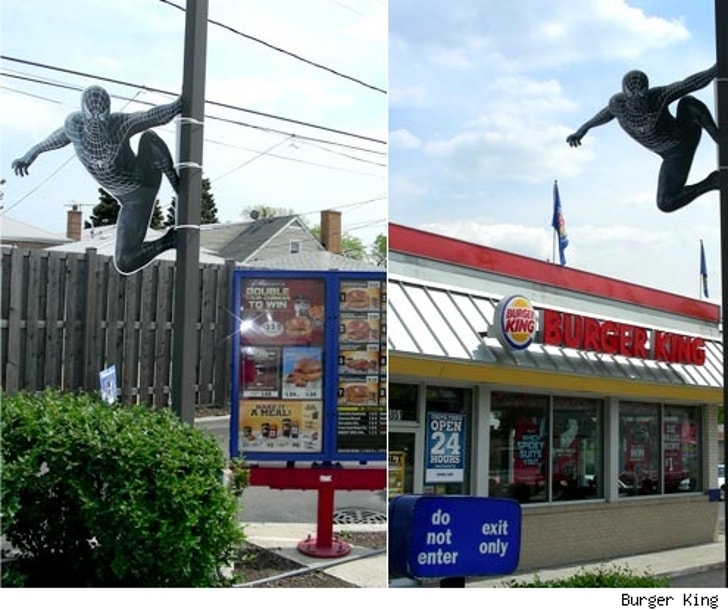
Identify the location of red border along the roof. This screenshot has width=728, height=610. (529, 262).